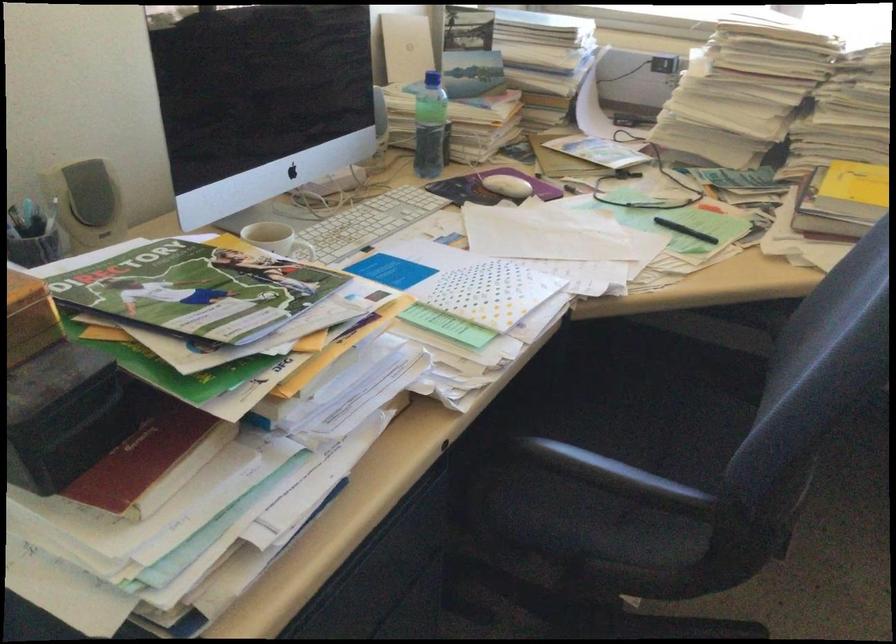
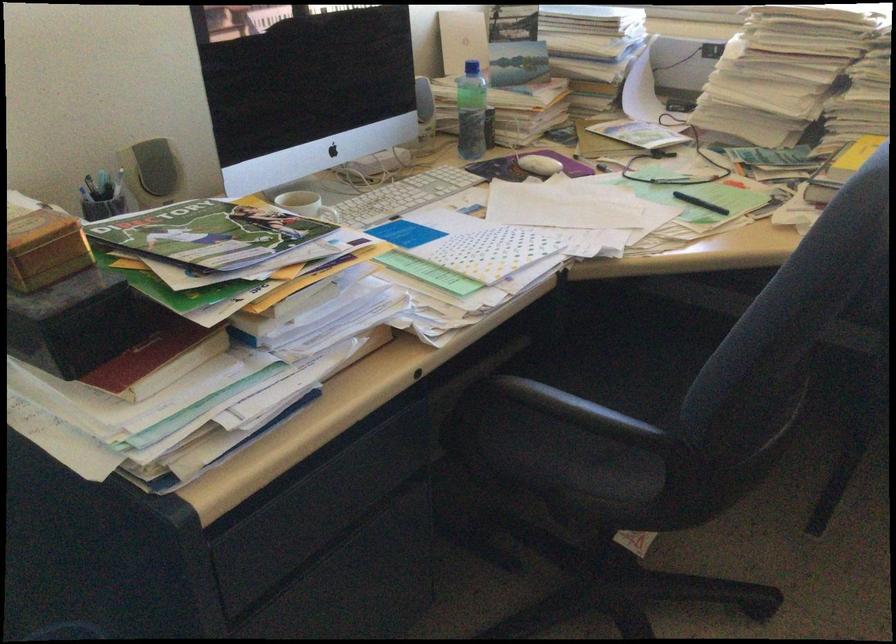
Locate, in the second image, the point that corresponds to point 509,187 in the first image.

(538, 165)